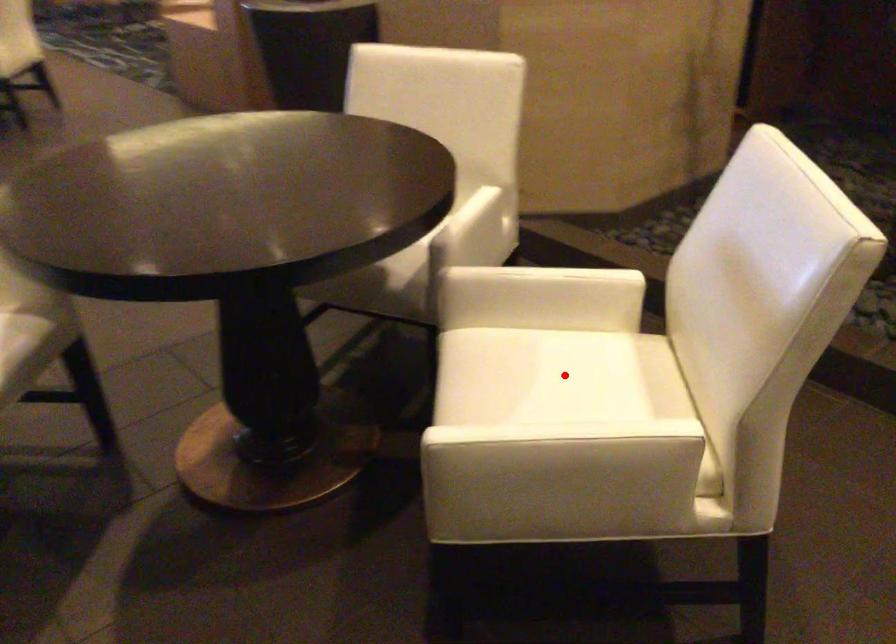
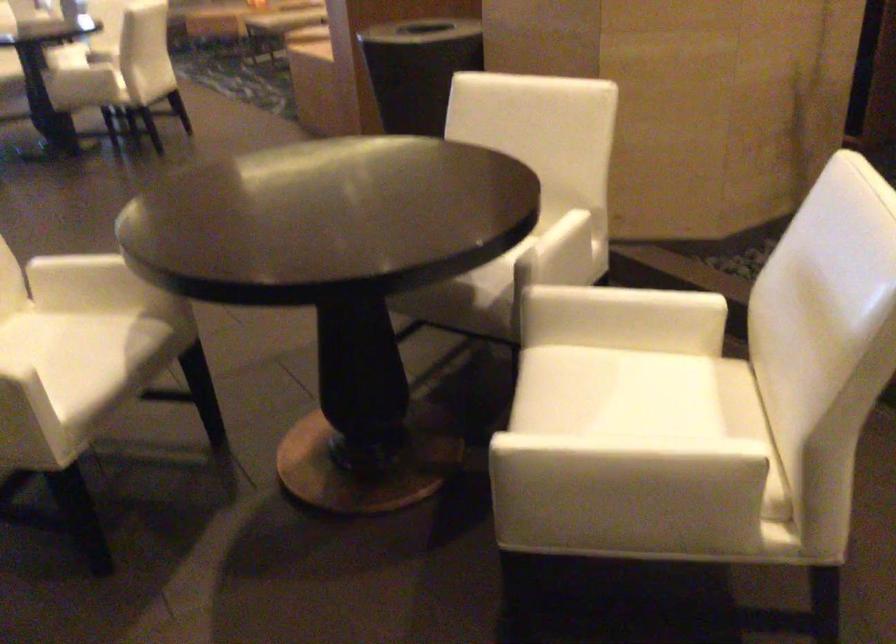
Question: I am providing you with two images of the same scene from different viewpoints. A red point is marked on the first image. Is the red point's position out of view in image 2?

Choices:
 (A) Yes
 (B) No

Answer: (B)